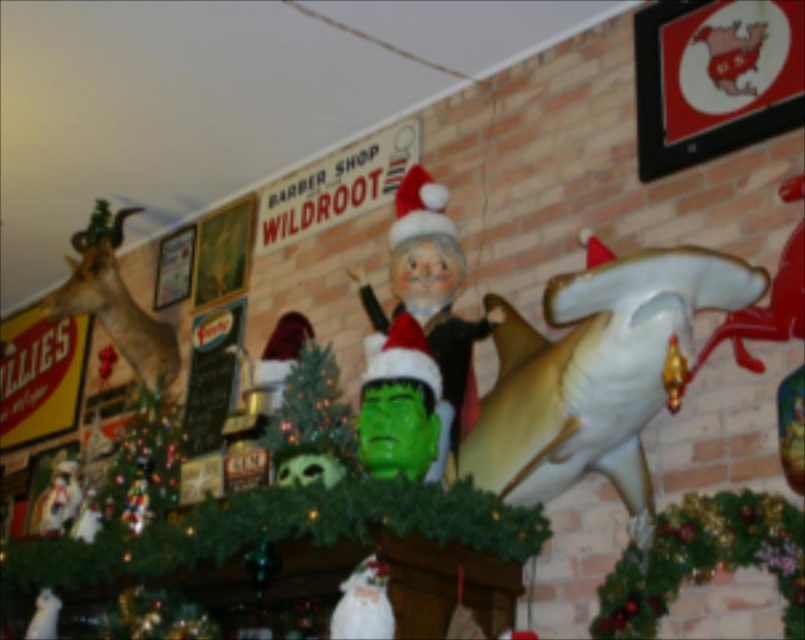
Which of these two, matte plastic santa at center or shiny gold deer at upper left, stands shorter?

Standing shorter between the two is shiny gold deer at upper left.

Who is more forward, (x=475, y=337) or (x=120, y=349)?

Point (x=475, y=337) is more forward.

Where is `matte plastic santa at center`? The image size is (805, 640). matte plastic santa at center is located at coordinates (436, 300).

Is white glossy shark at right to the right of green matte wreath at lower right from the viewer's perspective?

In fact, white glossy shark at right is to the left of green matte wreath at lower right.

Looking at this image, is white glossy shark at right taller than green matte wreath at lower right?

Yes.

Between point (587, 376) and point (700, 529), which one is positioned behind?

Positioned behind is point (587, 376).

Find the location of a particular element. white glossy shark at right is located at coordinates (593, 374).

Can you confirm if green matte wreath at lower right is wider than matte plastic santa at center?

No, green matte wreath at lower right is not wider than matte plastic santa at center.

What do you see at coordinates (704, 557) in the screenshot? I see `green matte wreath at lower right` at bounding box center [704, 557].

Is point (612, 621) positioned behind point (459, 346)?

No, (612, 621) is closer to viewer.

Find the location of a particular element. green matte wreath at lower right is located at coordinates (704, 557).